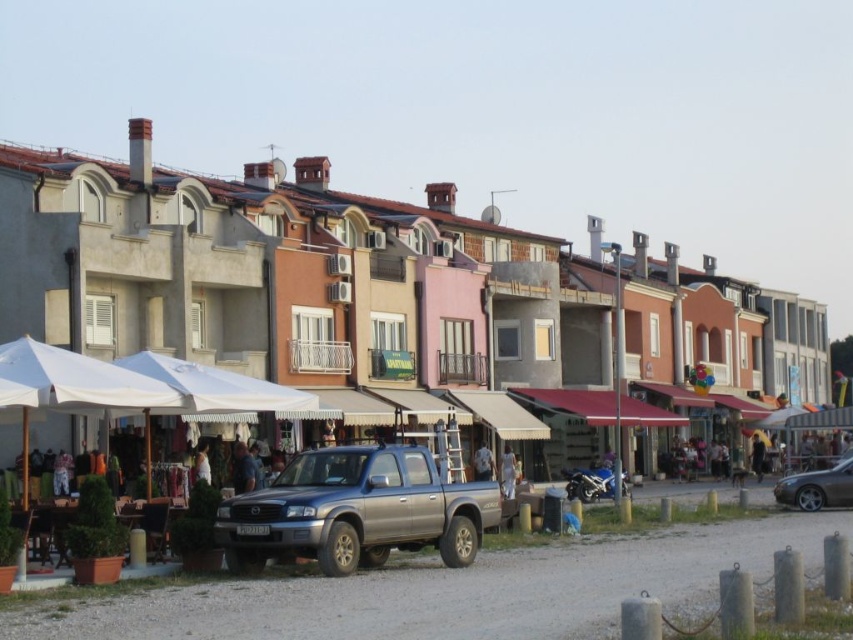
Can you confirm if metallic silver truck at lower center is wider than satin metallic pickup truck at center?

Yes, metallic silver truck at lower center is wider than satin metallic pickup truck at center.

Between metallic silver truck at lower center and satin metallic pickup truck at center, which one has less height?

satin metallic pickup truck at center is shorter.

Measure the distance between point (x=579, y=301) and camera.

A distance of 358.59 feet exists between point (x=579, y=301) and camera.

Where is `metallic silver truck at lower center`? metallic silver truck at lower center is located at coordinates (393, 307).

Can you confirm if metallic silver truck at lower center is positioned below shiny silver sedan at lower right?

Actually, metallic silver truck at lower center is above shiny silver sedan at lower right.

Is metallic silver truck at lower center above shiny silver sedan at lower right?

Correct, metallic silver truck at lower center is located above shiny silver sedan at lower right.

Is point (334, 374) closer to viewer compared to point (804, 506)?

No, it is not.

Locate an element on the screen. The image size is (853, 640). metallic silver truck at lower center is located at coordinates (393, 307).

Between satin metallic pickup truck at center and shiny silver sedan at lower right, which one is positioned higher?

satin metallic pickup truck at center is higher up.

What do you see at coordinates (357, 512) in the screenshot?
I see `satin metallic pickup truck at center` at bounding box center [357, 512].

Who is more forward, (401, 445) or (848, 477)?

Positioned in front is point (401, 445).

Locate an element on the screen. satin metallic pickup truck at center is located at coordinates (357, 512).